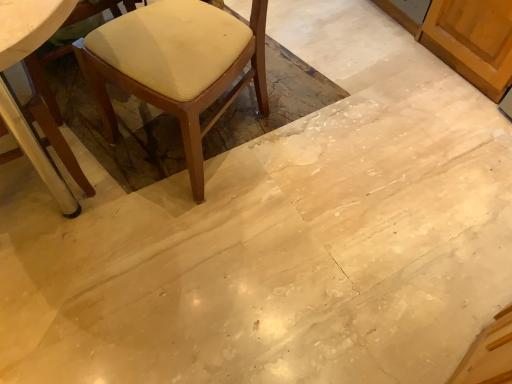
This screenshot has height=384, width=512. I want to click on wooden chair at left, which is the 2th chair in right-to-left order, so 59,143.

What do you see at coordinates (59, 143) in the screenshot? I see `wooden chair at left, which is the 2th chair in right-to-left order` at bounding box center [59, 143].

Describe the element at coordinates (177, 66) in the screenshot. I see `matte beige cushioned chair at left, the second chair positioned from the left` at that location.

How much space does matte beige cushioned chair at left, the second chair positioned from the left, occupy vertically?

matte beige cushioned chair at left, the second chair positioned from the left, is 30.05 inches tall.

Measure the distance between matte beige cushioned chair at left, arranged as the first chair when viewed from the right, and camera.

They are 3.68 feet apart.

At what (x,y) coordinates should I click in order to perform the action: click on matte beige cushioned chair at left, arranged as the first chair when viewed from the right. Please return your answer as a coordinate pair (x, y). The height and width of the screenshot is (384, 512). Looking at the image, I should click on (177, 66).

Where is `wooden chair at left, which is the 2th chair in right-to-left order`? wooden chair at left, which is the 2th chair in right-to-left order is located at coordinates (59, 143).

Considering the positions of objects matte beige cushioned chair at left, the second chair positioned from the left, and wooden chair at left, the 1th chair when ordered from left to right, in the image provided, who is more to the left, matte beige cushioned chair at left, the second chair positioned from the left, or wooden chair at left, the 1th chair when ordered from left to right,?

From the viewer's perspective, wooden chair at left, the 1th chair when ordered from left to right, appears more on the left side.

Which object is further away from the camera taking this photo, matte beige cushioned chair at left, the second chair positioned from the left, or wooden chair at left, which is the 2th chair in right-to-left order?

matte beige cushioned chair at left, the second chair positioned from the left, is further away from the camera.

Which point is more forward, (194, 19) or (51, 135)?

The point (51, 135) is more forward.

From the image's perspective, is matte beige cushioned chair at left, the second chair positioned from the left, over wooden chair at left, which is the 2th chair in right-to-left order?

Yes.

From a real-world perspective, is matte beige cushioned chair at left, arranged as the first chair when viewed from the right, physically above wooden chair at left, which is the 2th chair in right-to-left order?

Yes, from a real-world perspective, matte beige cushioned chair at left, arranged as the first chair when viewed from the right, is over wooden chair at left, which is the 2th chair in right-to-left order

Between matte beige cushioned chair at left, arranged as the first chair when viewed from the right, and wooden chair at left, which is the 2th chair in right-to-left order, which one has larger width?

Wider between the two is matte beige cushioned chair at left, arranged as the first chair when viewed from the right.

Who is taller, matte beige cushioned chair at left, the second chair positioned from the left, or wooden chair at left, the 1th chair when ordered from left to right?

With more height is matte beige cushioned chair at left, the second chair positioned from the left.

Which of these two, matte beige cushioned chair at left, arranged as the first chair when viewed from the right, or wooden chair at left, which is the 2th chair in right-to-left order, is smaller?

With smaller size is wooden chair at left, which is the 2th chair in right-to-left order.

Would you say matte beige cushioned chair at left, the second chair positioned from the left, is outside wooden chair at left, which is the 2th chair in right-to-left order?

Yes, matte beige cushioned chair at left, the second chair positioned from the left, is located beyond the bounds of wooden chair at left, which is the 2th chair in right-to-left order.

Would you consider matte beige cushioned chair at left, the second chair positioned from the left, to be distant from wooden chair at left, which is the 2th chair in right-to-left order?

matte beige cushioned chair at left, the second chair positioned from the left, is near wooden chair at left, which is the 2th chair in right-to-left order, not far away.

Could you tell me if matte beige cushioned chair at left, arranged as the first chair when viewed from the right, is turned towards wooden chair at left, which is the 2th chair in right-to-left order?

No, matte beige cushioned chair at left, arranged as the first chair when viewed from the right, is not turned towards wooden chair at left, which is the 2th chair in right-to-left order.

How many degrees apart are the facing directions of matte beige cushioned chair at left, arranged as the first chair when viewed from the right, and wooden chair at left, which is the 2th chair in right-to-left order?

They differ by 155 degrees in their facing directions.

Locate an element on the screen. The height and width of the screenshot is (384, 512). chair located in front of the matte beige cushioned chair at left, the second chair positioned from the left is located at coordinates (59, 143).

Considering the relative positions of wooden chair at left, which is the 2th chair in right-to-left order, and matte beige cushioned chair at left, the second chair positioned from the left, in the image provided, is wooden chair at left, which is the 2th chair in right-to-left order, to the right of matte beige cushioned chair at left, the second chair positioned from the left, from the viewer's perspective?

Incorrect, wooden chair at left, which is the 2th chair in right-to-left order, is not on the right side of matte beige cushioned chair at left, the second chair positioned from the left.

In the scene shown: Is wooden chair at left, which is the 2th chair in right-to-left order, in front of or behind matte beige cushioned chair at left, the second chair positioned from the left, in the image?

Visually, wooden chair at left, which is the 2th chair in right-to-left order, is located in front of matte beige cushioned chair at left, the second chair positioned from the left.

Which is behind, point (19, 55) or point (113, 37)?

Point (113, 37)

From the image's perspective, which object appears higher, wooden chair at left, which is the 2th chair in right-to-left order, or matte beige cushioned chair at left, the second chair positioned from the left?

matte beige cushioned chair at left, the second chair positioned from the left, appears higher in the image.

From a real-world perspective, is wooden chair at left, the 1th chair when ordered from left to right, physically located above or below matte beige cushioned chair at left, the second chair positioned from the left?

wooden chair at left, the 1th chair when ordered from left to right, is situated lower than matte beige cushioned chair at left, the second chair positioned from the left, in the real world.

Looking at their sizes, would you say wooden chair at left, the 1th chair when ordered from left to right, is wider or thinner than matte beige cushioned chair at left, the second chair positioned from the left?

Considering their sizes, wooden chair at left, the 1th chair when ordered from left to right, looks slimmer than matte beige cushioned chair at left, the second chair positioned from the left.

In terms of height, does wooden chair at left, the 1th chair when ordered from left to right, look taller or shorter compared to matte beige cushioned chair at left, the second chair positioned from the left?

wooden chair at left, the 1th chair when ordered from left to right, is shorter than matte beige cushioned chair at left, the second chair positioned from the left.

Can you confirm if wooden chair at left, the 1th chair when ordered from left to right, is bigger than matte beige cushioned chair at left, the second chair positioned from the left?

No.

Is matte beige cushioned chair at left, the second chair positioned from the left, inside wooden chair at left, which is the 2th chair in right-to-left order?

No.

Is wooden chair at left, the 1th chair when ordered from left to right, far from matte beige cushioned chair at left, the second chair positioned from the left?

That's not correct — wooden chair at left, the 1th chair when ordered from left to right, is a little close to matte beige cushioned chair at left, the second chair positioned from the left.

Could you tell me if wooden chair at left, which is the 2th chair in right-to-left order, is facing matte beige cushioned chair at left, arranged as the first chair when viewed from the right?

Yes, wooden chair at left, which is the 2th chair in right-to-left order, is aimed at matte beige cushioned chair at left, arranged as the first chair when viewed from the right.

How many degrees apart are the facing directions of wooden chair at left, the 1th chair when ordered from left to right, and matte beige cushioned chair at left, the second chair positioned from the left?

155 degrees separate the facing orientations of wooden chair at left, the 1th chair when ordered from left to right, and matte beige cushioned chair at left, the second chair positioned from the left.

Locate an element on the screen. This screenshot has width=512, height=384. chair above the wooden chair at left, which is the 2th chair in right-to-left order (from a real-world perspective) is located at coordinates (177, 66).

Locate an element on the screen. This screenshot has height=384, width=512. chair behind the wooden chair at left, the 1th chair when ordered from left to right is located at coordinates (177, 66).

The width and height of the screenshot is (512, 384). Identify the location of chair above the wooden chair at left, the 1th chair when ordered from left to right (from the image's perspective). 177,66.